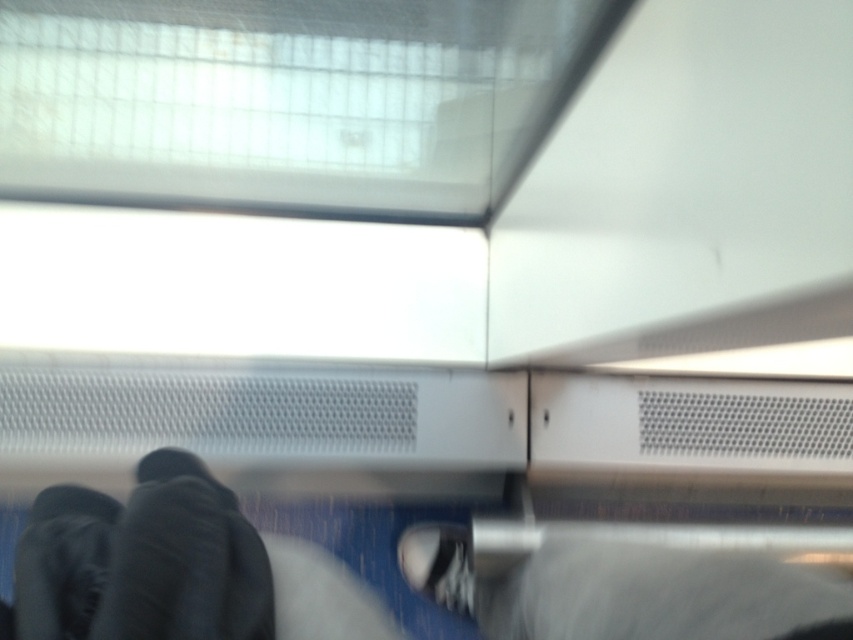
You are a delivery robot that needs to navigate through a narrow space in this vehicle. You see the dark gray fabric jacket at lower left and the white matte shoe at center. Which object is wider and could potentially block your path?

The dark gray fabric jacket at lower left might be wider than the white matte shoe at center, so it could potentially block the path more than the white matte shoe at center.

You are standing in a vehicle and see a point marked at coordinates (141,561). Based on the scene, what object is this point located on?

The point is located on the dark gray fabric jacket at lower left.